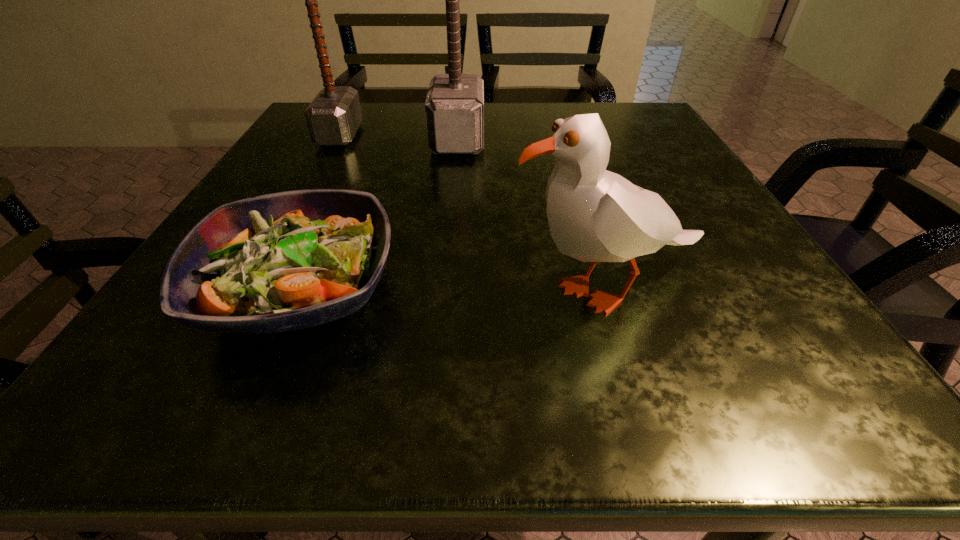
Image resolution: width=960 pixels, height=540 pixels. In order to click on the second closest object to the left hammer in this screenshot , I will do `click(285, 261)`.

You are a GUI agent. You are given a task and a screenshot of the screen. Output one action in this format:
    pyautogui.click(x=<x>, y=<y>)
    Task: Click on the free space that satisfies the following two spatial constraints: 1. for striking with the head of the right hammer; 2. on the front side of the shortest object
    
    Given the screenshot: What is the action you would take?
    pyautogui.click(x=445, y=289)

The width and height of the screenshot is (960, 540). In order to click on vacant area that satisfies the following two spatial constraints: 1. on the back side of the salad plate; 2. on the striking surface of the left hammer in this screenshot , I will do `click(369, 135)`.